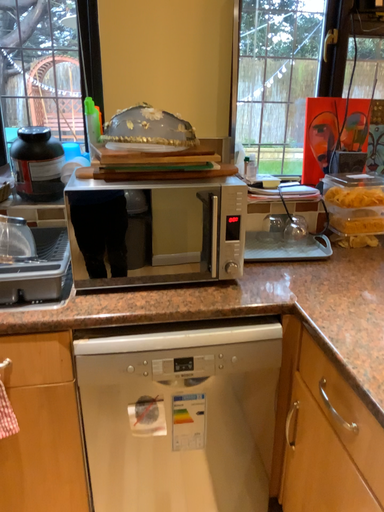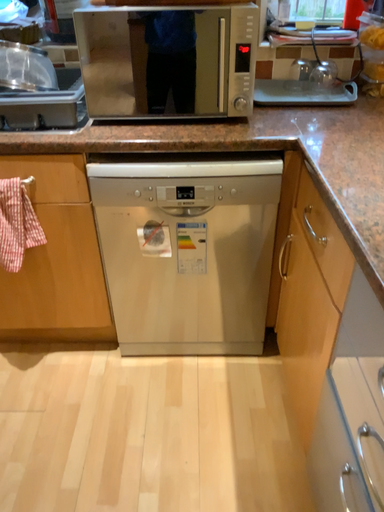
Question: Which way did the camera rotate in the video?

Choices:
 (A) rotated right
 (B) rotated left

Answer: (B)